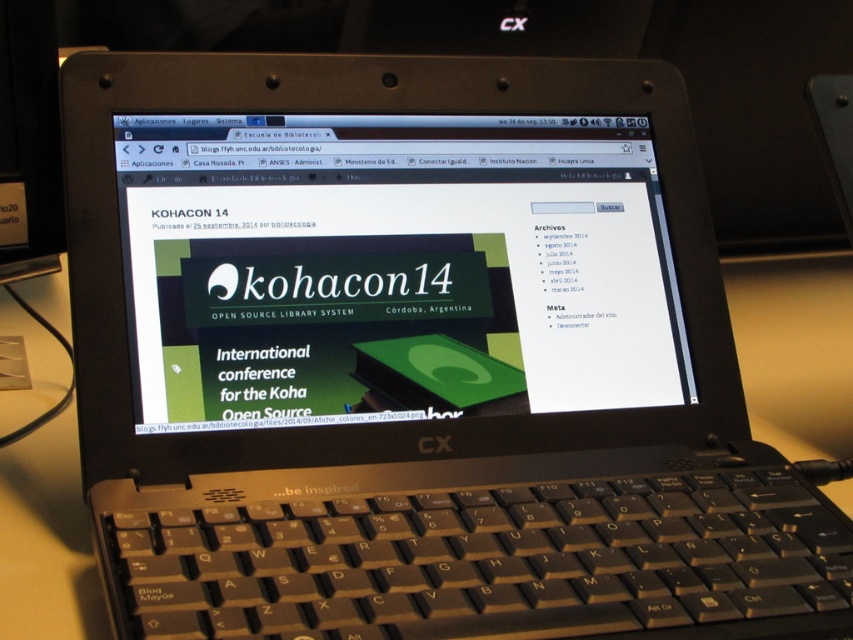
You are a photographer trying to capture a close shot of the laptop screen. You want to focus on the point at the lower right corner of the screen. However, you notice two points on the screen at coordinates point (442, 220) and point (350, 540). Which point should you focus on to ensure the lower right corner is in focus?

You should focus on point (350, 540) because it is closer to the camera than point (442, 220). Since the lower right corner is likely closer to the camera, focusing on the closer point will ensure better focus on that area.